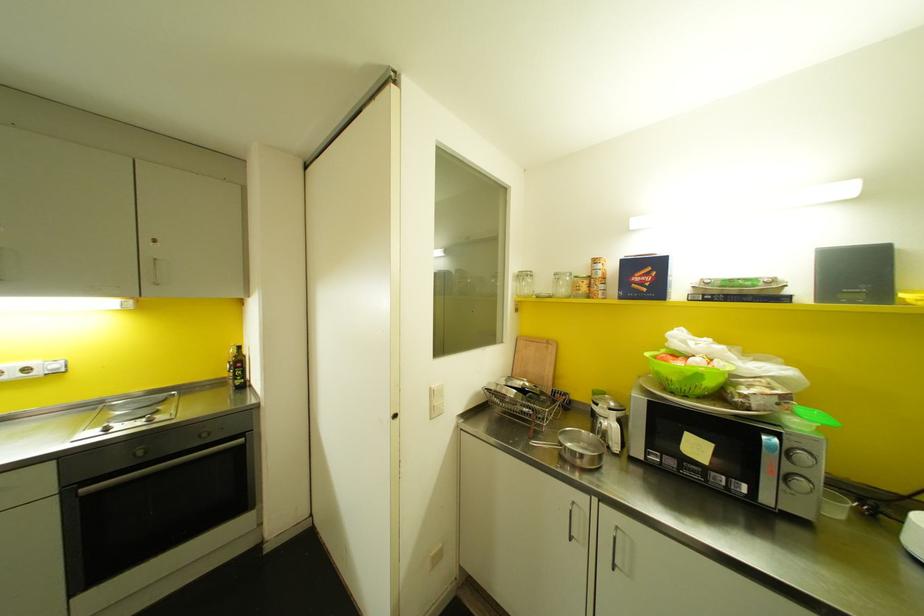
Identify the location of white light switch. The height and width of the screenshot is (616, 924). (435, 400).